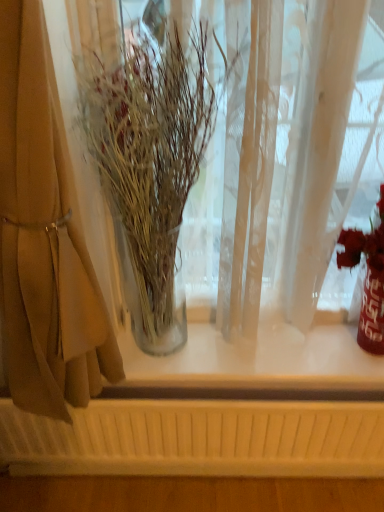
Question: Is shiny metallic vase at right with clear glass vase at left?

Choices:
 (A) yes
 (B) no

Answer: (B)

Question: From a real-world perspective, is shiny metallic vase at right located beneath clear glass vase at left?

Choices:
 (A) no
 (B) yes

Answer: (B)

Question: From a real-world perspective, is shiny metallic vase at right physically above clear glass vase at left?

Choices:
 (A) no
 (B) yes

Answer: (A)

Question: Is shiny metallic vase at right far away from clear glass vase at left?

Choices:
 (A) yes
 (B) no

Answer: (B)

Question: From the image's perspective, is shiny metallic vase at right located beneath clear glass vase at left?

Choices:
 (A) yes
 (B) no

Answer: (A)

Question: In the image, is clear glass vase at left positioned in front of or behind shiny metallic vase at right?

Choices:
 (A) front
 (B) behind

Answer: (A)

Question: Is clear glass vase at left inside the boundaries of shiny metallic vase at right, or outside?

Choices:
 (A) outside
 (B) inside

Answer: (A)

Question: From a real-world perspective, is clear glass vase at left above or below shiny metallic vase at right?

Choices:
 (A) below
 (B) above

Answer: (B)

Question: Is clear glass vase at left wider or thinner than shiny metallic vase at right?

Choices:
 (A) thin
 (B) wide

Answer: (B)

Question: Based on their positions, is beige fabric curtain at left located to the left or right of shiny metallic vase at right?

Choices:
 (A) left
 (B) right

Answer: (A)

Question: From the image's perspective, is beige fabric curtain at left positioned above or below shiny metallic vase at right?

Choices:
 (A) above
 (B) below

Answer: (A)

Question: Considering their positions, is beige fabric curtain at left located in front of or behind shiny metallic vase at right?

Choices:
 (A) front
 (B) behind

Answer: (A)

Question: From a real-world perspective, relative to shiny metallic vase at right, is beige fabric curtain at left vertically above or below?

Choices:
 (A) below
 (B) above

Answer: (B)

Question: From a real-world perspective, is shiny metallic vase at right positioned above or below beige fabric curtain at left?

Choices:
 (A) below
 (B) above

Answer: (A)

Question: Based on their sizes in the image, would you say shiny metallic vase at right is bigger or smaller than beige fabric curtain at left?

Choices:
 (A) small
 (B) big

Answer: (A)